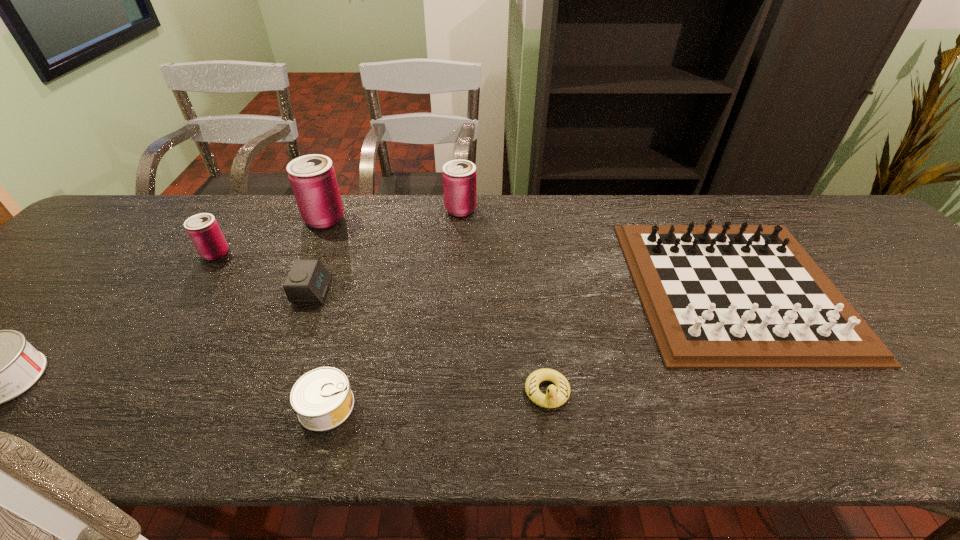
This screenshot has width=960, height=540. Find the location of `the second pink can from left to right`. the second pink can from left to right is located at coordinates (312, 177).

The width and height of the screenshot is (960, 540). What are the coordinates of `the third can from left to right` in the screenshot? It's located at (312, 177).

At what (x,y) coordinates should I click in order to perform the action: click on the seventh shortest object. Please return your answer as a coordinate pair (x, y). The height and width of the screenshot is (540, 960). Looking at the image, I should click on (459, 176).

The image size is (960, 540). What are the coordinates of `the second tallest can` in the screenshot? It's located at (459, 176).

The image size is (960, 540). What are the coordinates of `the sixth shortest object` in the screenshot? It's located at (203, 229).

Where is `the nearest pink can`? the nearest pink can is located at coordinates (203, 229).

This screenshot has width=960, height=540. Find the location of `gameboard`. gameboard is located at coordinates (744, 296).

Locate an element on the screen. This screenshot has height=540, width=960. the rightmost object is located at coordinates [744, 296].

Locate an element on the screen. This screenshot has height=540, width=960. alarm clock is located at coordinates (307, 282).

Identify the location of duckling. The width and height of the screenshot is (960, 540). (556, 396).